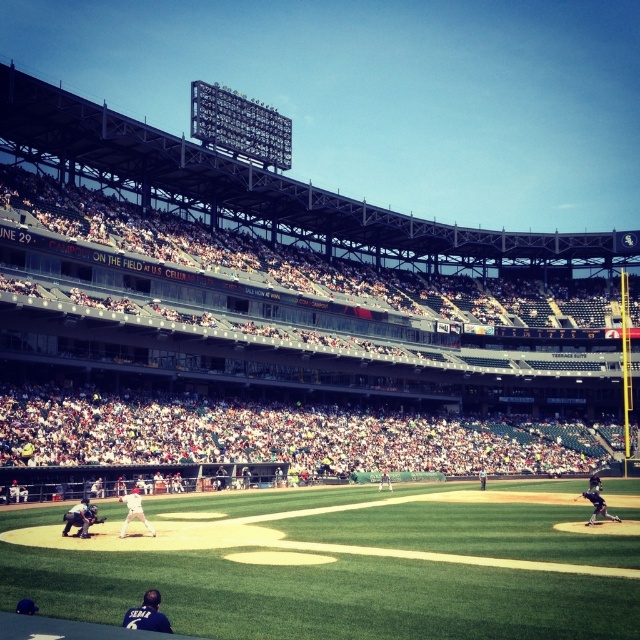
Question: Which of the following is the farthest from the observer?

Choices:
 (A) white uniform at center
 (B) black uniform at center
 (C) green grass baseball field at center
 (D) brown leather glove at center

Answer: (B)

Question: Is white uniform at center smaller than white baseball glove at center?

Choices:
 (A) no
 (B) yes

Answer: (A)

Question: Is green grass baseball field at center below white baseball glove at center?

Choices:
 (A) yes
 (B) no

Answer: (B)

Question: Which of the following is the farthest from the observer?

Choices:
 (A) green grass baseball field at center
 (B) white baseball glove at center

Answer: (B)

Question: Estimate the real-world distances between objects in this image. Which object is farther from the green grass baseball field at center?

Choices:
 (A) black uniform at center
 (B) white uniform at center

Answer: (A)

Question: Is green grass baseball field at center below brown leather glove at center?

Choices:
 (A) yes
 (B) no

Answer: (A)